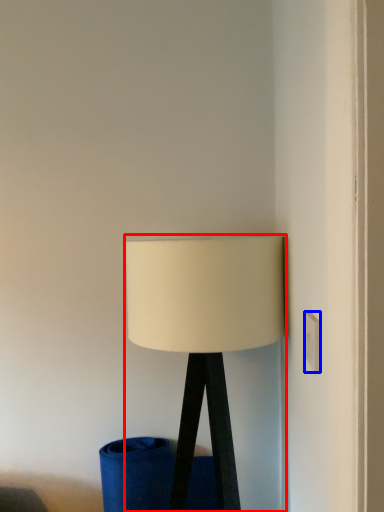
Question: Among these objects, which one is farthest to the camera, lamp (highlighted by a red box) or electric outlet (highlighted by a blue box)?

Choices:
 (A) lamp
 (B) electric outlet

Answer: (A)